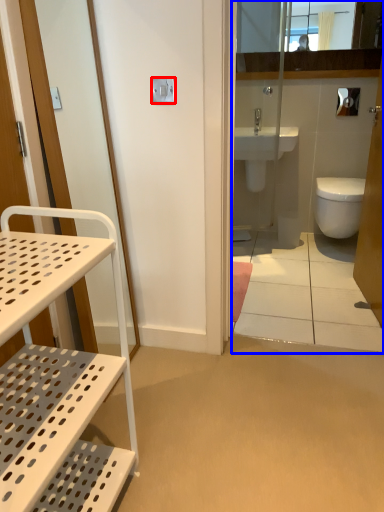
Question: Which point is further to the camera, lock (highlighted by a red box) or corridor (highlighted by a blue box)?

Choices:
 (A) lock
 (B) corridor

Answer: (A)